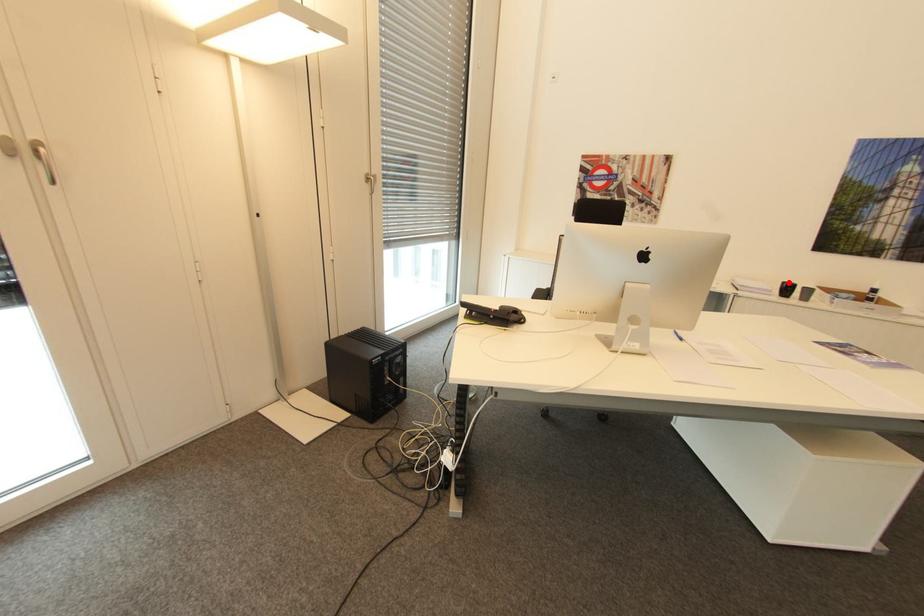
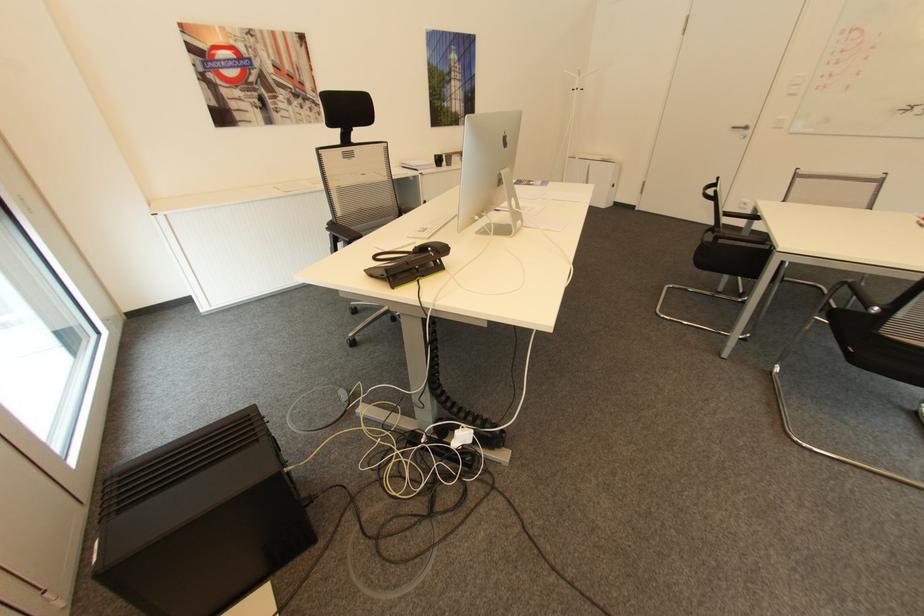
Question: A red point is marked in image1. In image2, is the corresponding 3D point closer to the camera or farther? Reply with the corresponding letter.

Choices:
 (A) The corresponding 3D point is closer.
 (B) The corresponding 3D point is farther.

Answer: (A)